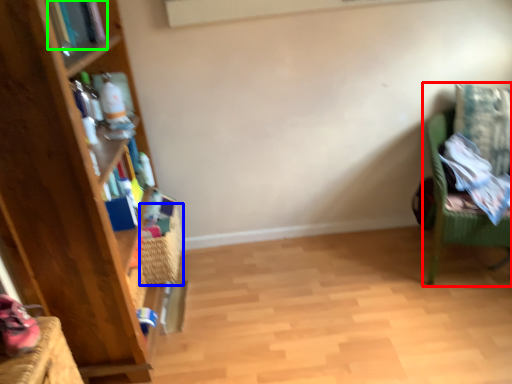
Question: Which is nearer to the chair (highlighted by a red box)? basket (highlighted by a blue box) or book (highlighted by a green box).

Choices:
 (A) basket
 (B) book

Answer: (A)